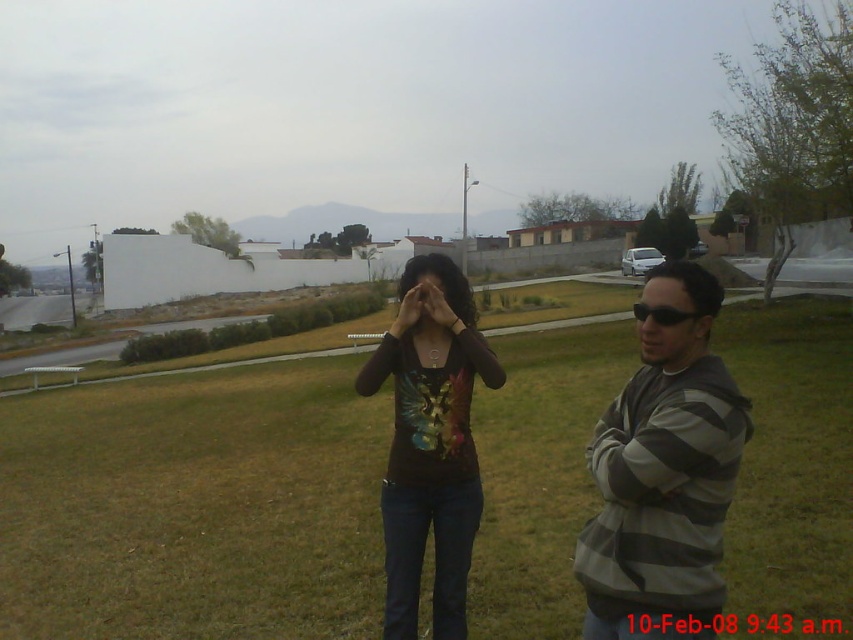
Question: Is green grass at center wider than black plastic sunglasses at center?

Choices:
 (A) yes
 (B) no

Answer: (A)

Question: Which point is farther to the camera?

Choices:
 (A) green grass at center
 (B) gray striped sweater at right

Answer: (A)

Question: Among these objects, which one is nearest to the camera?

Choices:
 (A) black plastic sunglasses at center
 (B) matte black sunglasses at center
 (C) gray striped sweater at right

Answer: (C)

Question: Is the position of matte black sunglasses at center more distant than that of black plastic sunglasses at center?

Choices:
 (A) no
 (B) yes

Answer: (A)

Question: Is green grass at center to the right of matte black sunglasses at center from the viewer's perspective?

Choices:
 (A) no
 (B) yes

Answer: (B)

Question: Which point is farther to the camera?

Choices:
 (A) (640, 323)
 (B) (575, 566)
 (C) (670, 323)

Answer: (B)